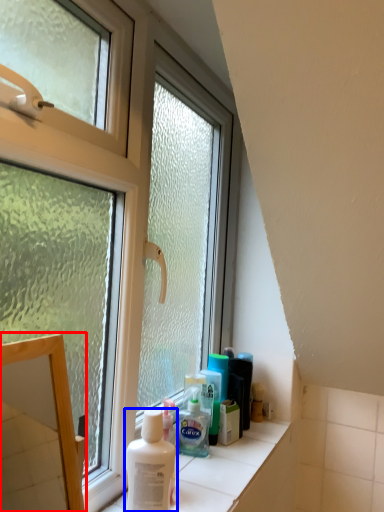
Question: Which of the following is the closest to the observer, mirror (highlighted by a red box) or shaving cream (highlighted by a blue box)?

Choices:
 (A) mirror
 (B) shaving cream

Answer: (A)